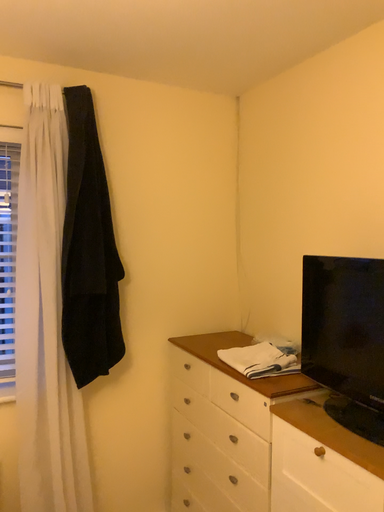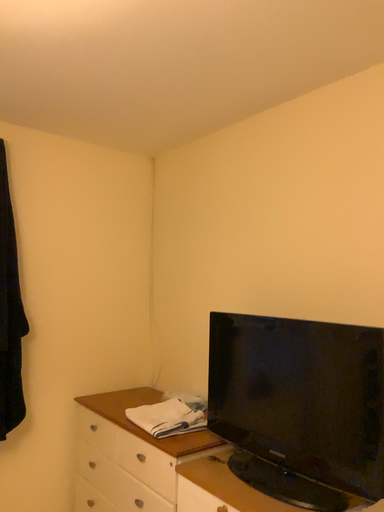
Question: How did the camera likely rotate when shooting the video?

Choices:
 (A) rotated left
 (B) rotated right

Answer: (B)